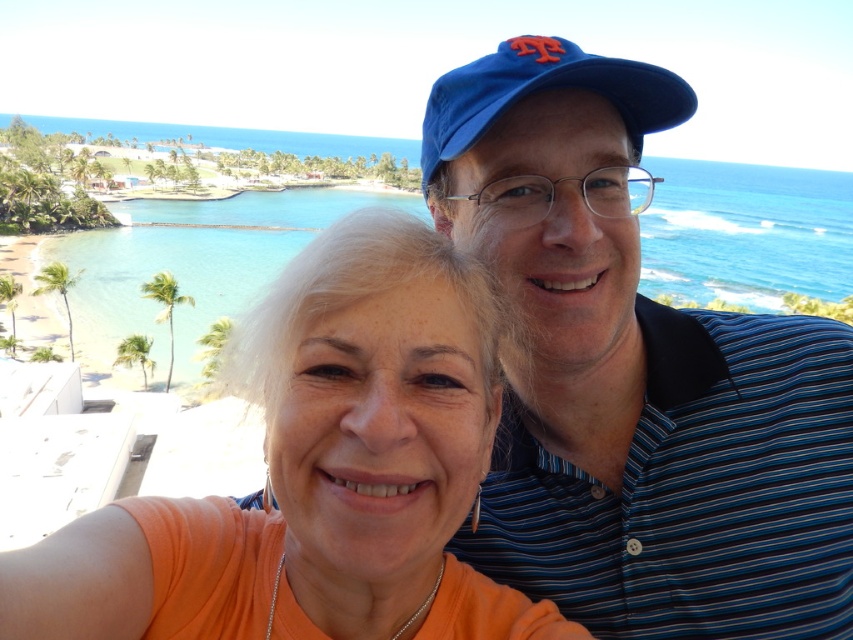
Question: Which point is closer to the camera taking this photo?

Choices:
 (A) (198, 228)
 (B) (525, 44)

Answer: (B)

Question: Does orange matte shirt at center appear under clear blue water at center?

Choices:
 (A) yes
 (B) no

Answer: (A)

Question: Which object is the closest to the blue striped polo shirt at upper right?

Choices:
 (A) blue fabric baseball cap at upper center
 (B) orange matte shirt at center

Answer: (B)

Question: Can you confirm if clear blue water at center is positioned above blue fabric baseball cap at upper center?

Choices:
 (A) yes
 (B) no

Answer: (A)

Question: Can you confirm if blue striped polo shirt at upper right is smaller than blue fabric baseball cap at upper center?

Choices:
 (A) yes
 (B) no

Answer: (A)

Question: Which object appears farthest from the camera in this image?

Choices:
 (A) clear blue water at center
 (B) blue fabric baseball cap at upper center
 (C) blue striped polo shirt at upper right
 (D) orange matte shirt at center

Answer: (A)